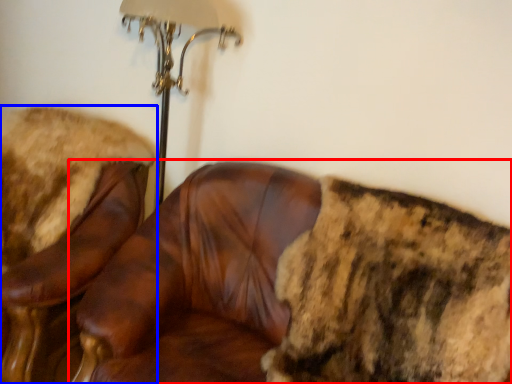
Question: Which of the following is the closest to the observer, chair (highlighted by a red box) or chair (highlighted by a blue box)?

Choices:
 (A) chair
 (B) chair

Answer: (A)